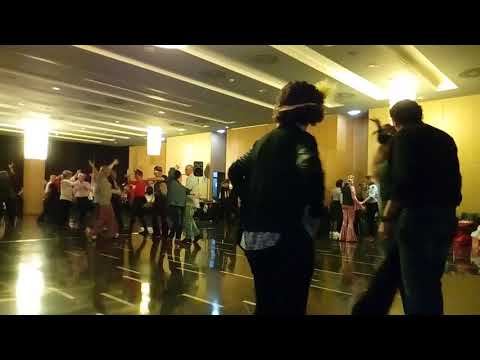
I want to click on very shiny black floor, so click(131, 286).